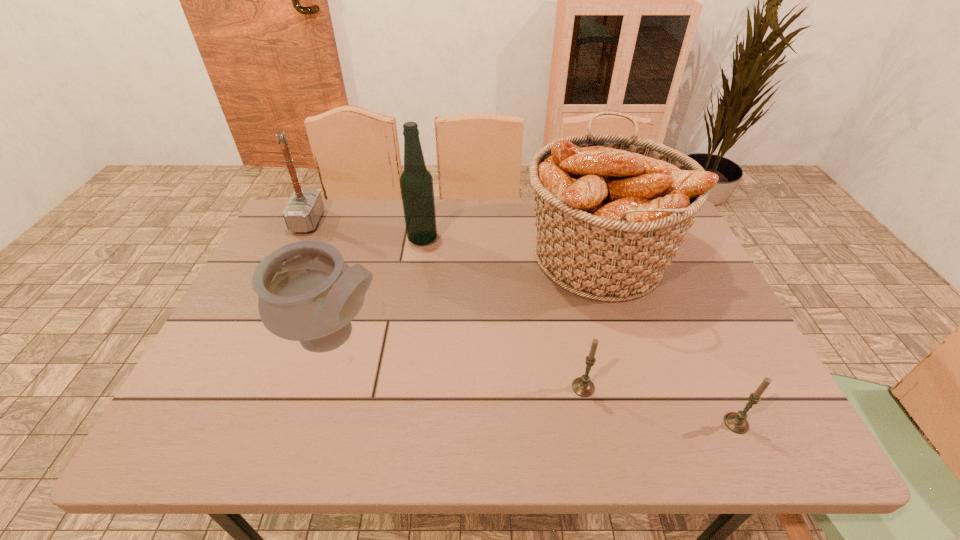
The height and width of the screenshot is (540, 960). In order to click on empty space between the pottery and the left candle in this screenshot , I will do [459, 361].

Where is `unoccupied position between the basket and the alcohol`? The height and width of the screenshot is (540, 960). unoccupied position between the basket and the alcohol is located at coordinates (511, 248).

At what (x,y) coordinates should I click in order to perform the action: click on empty space that is in between the pottery and the nearest object. Please return your answer as a coordinate pair (x, y). The width and height of the screenshot is (960, 540). Looking at the image, I should click on (536, 379).

This screenshot has height=540, width=960. Identify the location of vacant space in between the nearest object and the left candle. (660, 405).

Where is `blank region between the hammer and the nearest object`? The image size is (960, 540). blank region between the hammer and the nearest object is located at coordinates (522, 322).

What are the coordinates of `empty space between the alcohol and the farther candle` in the screenshot? It's located at (503, 313).

Locate an element on the screen. free space between the leftmost object and the right candle is located at coordinates click(522, 322).

Find the location of a particular element. free area in between the right candle and the second nearest object is located at coordinates (660, 405).

Find the location of a particular element. The image size is (960, 540). vacant space in between the nearest object and the alcohol is located at coordinates (580, 331).

Where is `empty space between the pottery and the fifth farthest object`? This screenshot has height=540, width=960. empty space between the pottery and the fifth farthest object is located at coordinates (459, 361).